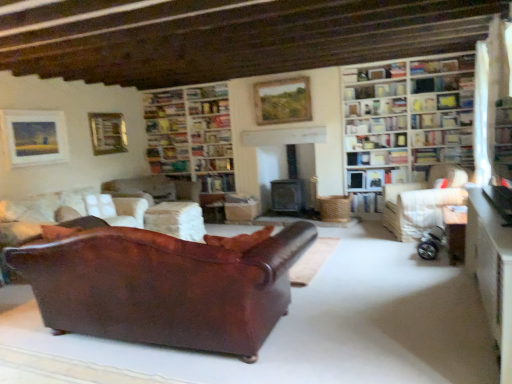
Where is `vacant space situated on the left part of wooden table at lower right, the 3th table viewed from the left`? The image size is (512, 384). vacant space situated on the left part of wooden table at lower right, the 3th table viewed from the left is located at coordinates (399, 259).